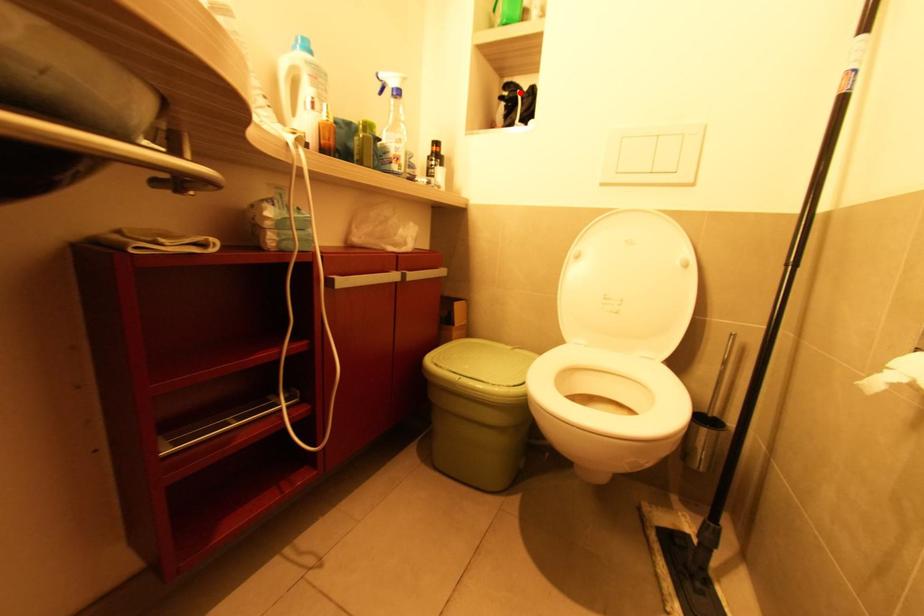
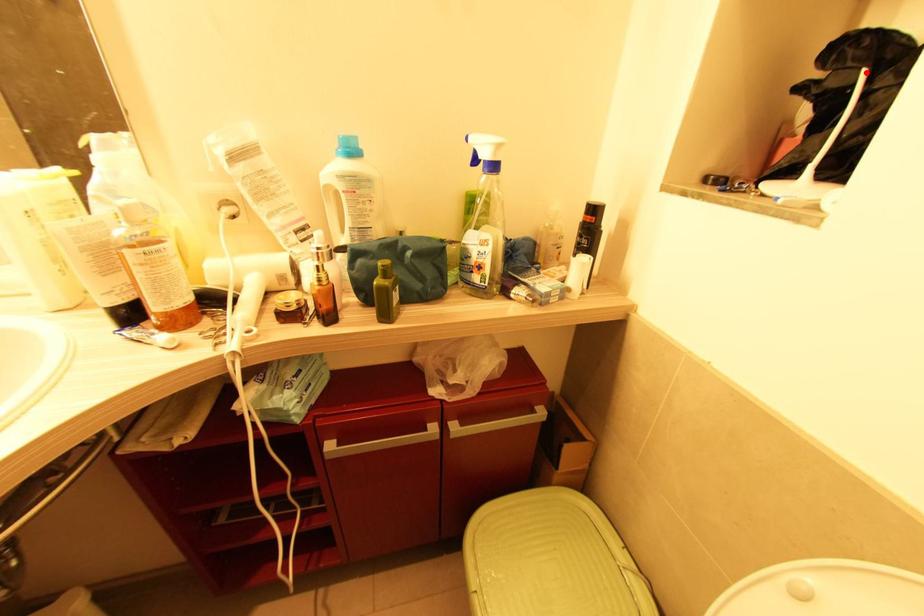
I am providing you with two images of the same scene from different viewpoints. A red point is marked on the first image and another point is marked on the second image. Is the marked point in image1 the same physical position as the marked point in image2?

Yes